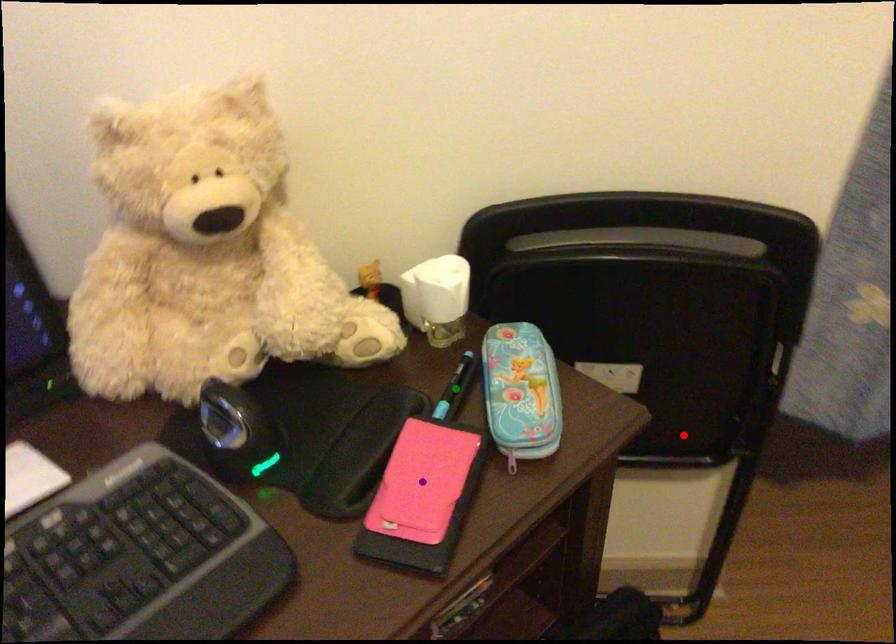
Order these from nearest to farthest:
purple point | red point | green point

purple point → green point → red point